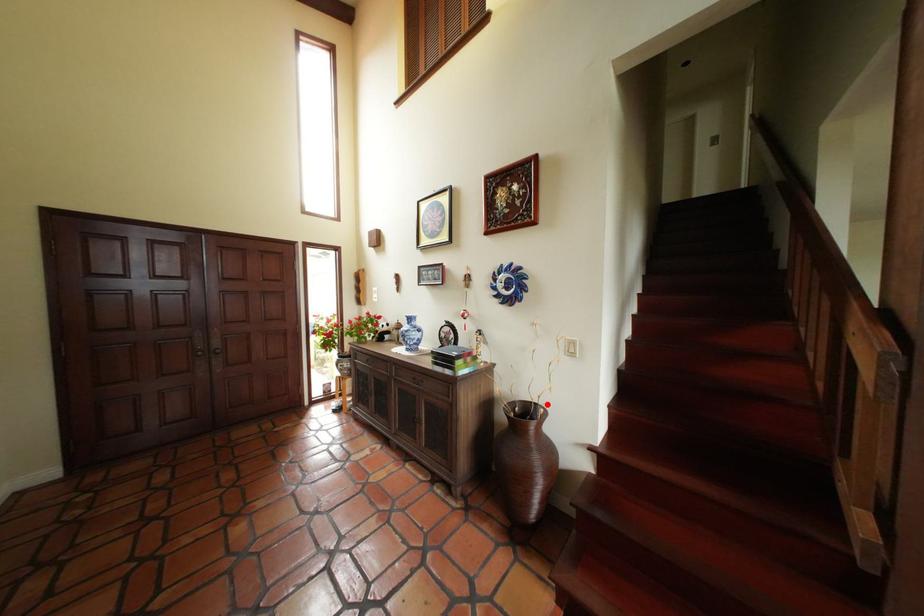
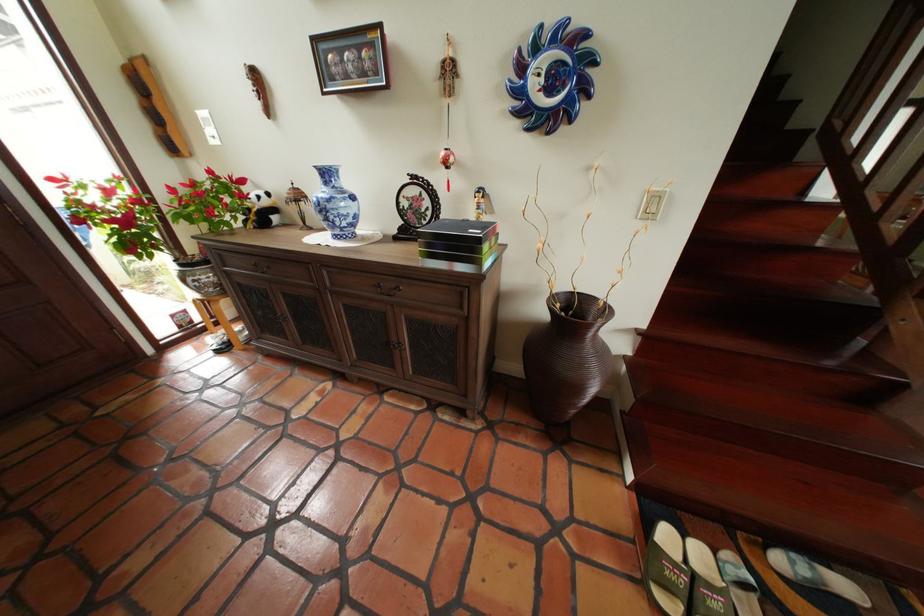
Locate, in the second image, the point that corresponds to the highlighted location in the first image.

(590, 294)